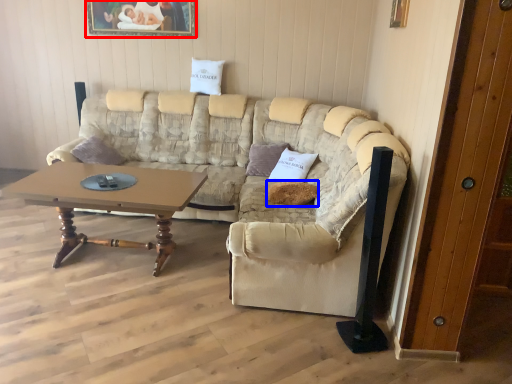
Question: Which point is further to the camera, picture frame (highlighted by a red box) or pillow (highlighted by a blue box)?

Choices:
 (A) picture frame
 (B) pillow

Answer: (A)